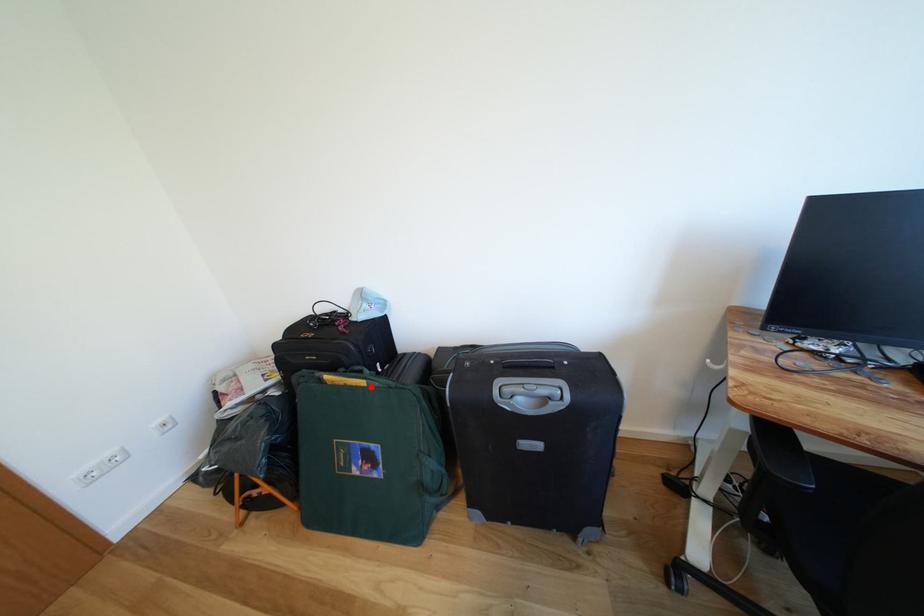
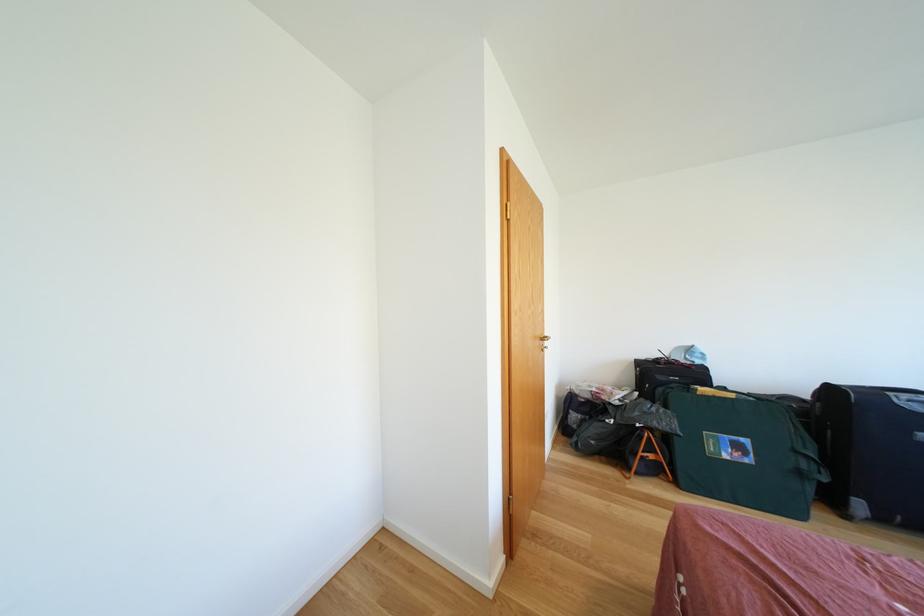
In the second image, find the point that corresponds to the highlighted location in the first image.

(739, 400)